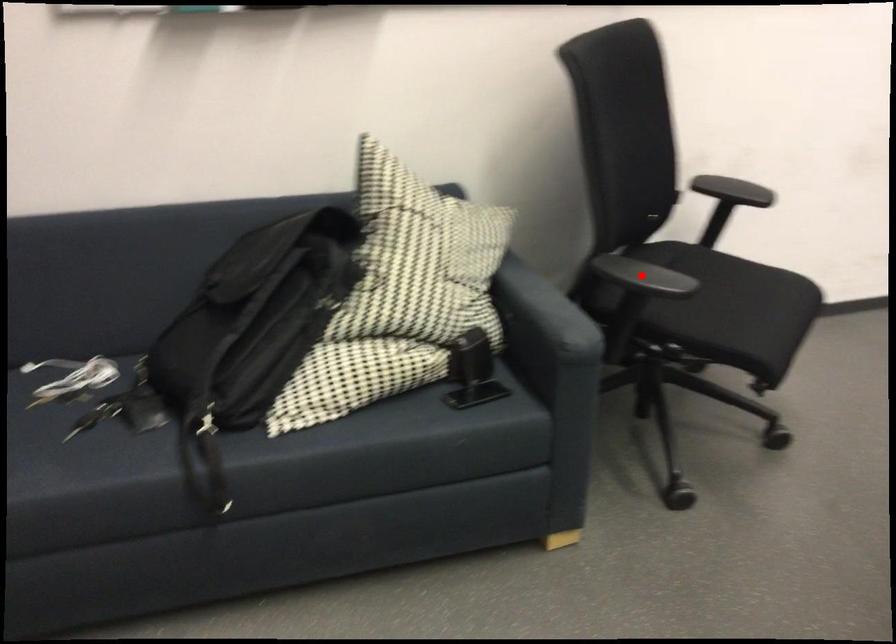
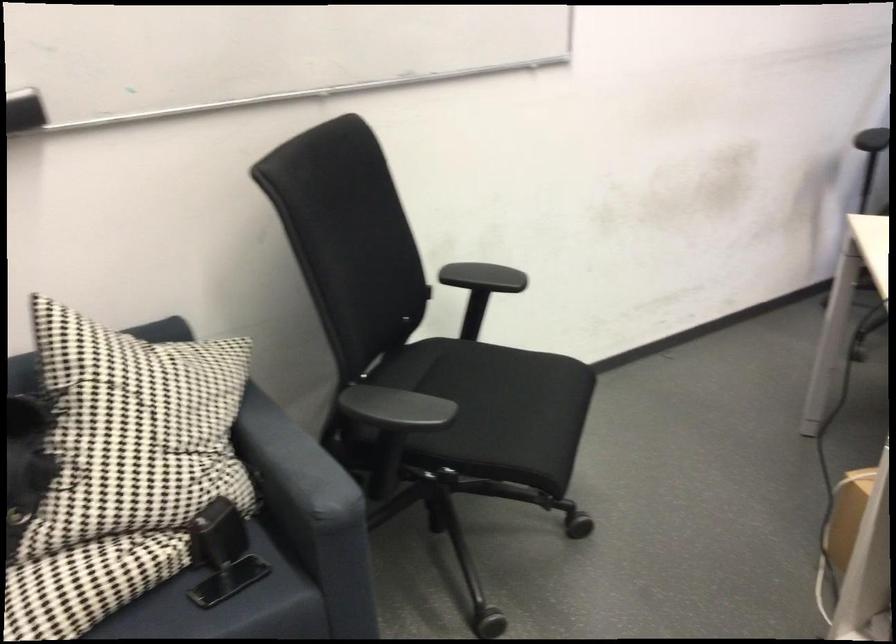
The point at the highlighted location is marked in the first image. Where is the corresponding point in the second image?

(395, 408)